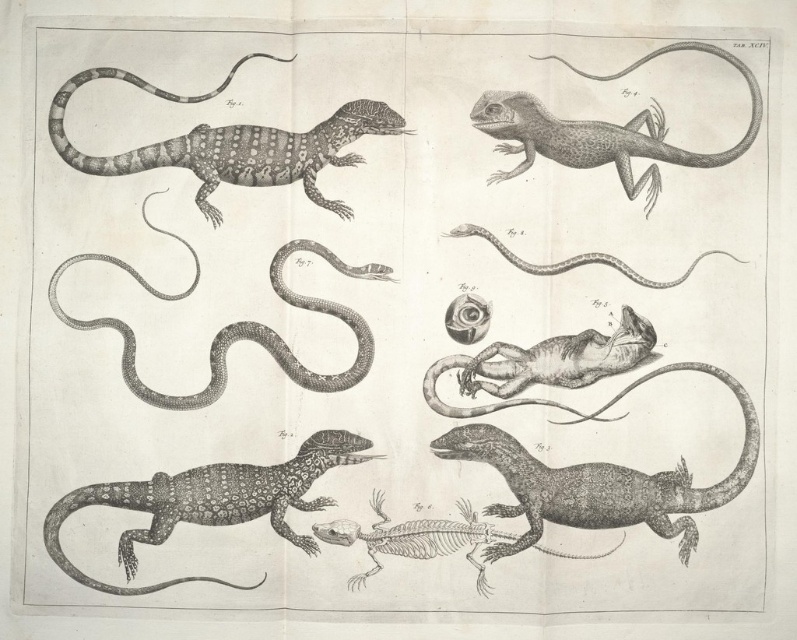
Question: Is smooth gray lizard at lower right smaller than smooth gray snake at upper center?

Choices:
 (A) no
 (B) yes

Answer: (A)

Question: Can you confirm if speckled patterned lizard at upper left is positioned to the right of patterned black lizard at lower left?

Choices:
 (A) no
 (B) yes

Answer: (B)

Question: Which point is closer to the camera?

Choices:
 (A) (222, 84)
 (B) (556, 262)
 (C) (368, 266)

Answer: (C)

Question: Which point is farther from the camera taking this photo?

Choices:
 (A) (218, 148)
 (B) (519, 547)
 (C) (203, 506)
 (D) (669, 285)

Answer: (A)

Question: Can you confirm if patterned black lizard at lower left is smaller than smooth gray lizard at upper right?

Choices:
 (A) yes
 (B) no

Answer: (B)

Question: Which of the following is the closest to the observer?

Choices:
 (A) patterned black lizard at lower left
 (B) smooth gray lizard at upper right

Answer: (A)